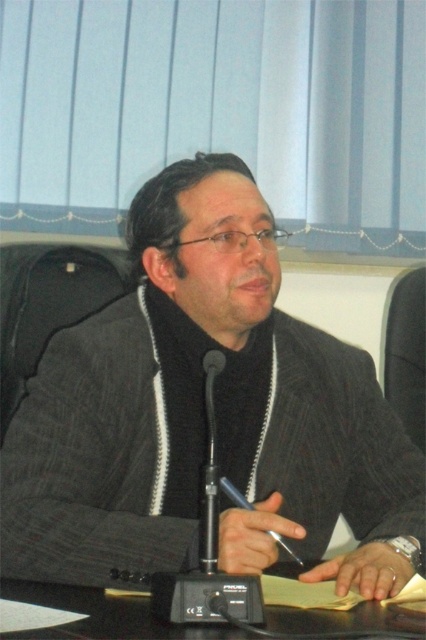
Question: Can you confirm if dark gray textured blazer at center is smaller than black glossy table at center?

Choices:
 (A) yes
 (B) no

Answer: (B)

Question: Which point appears closest to the camera in this image?

Choices:
 (A) (100, 369)
 (B) (210, 449)

Answer: (B)

Question: From the image, what is the correct spatial relationship of dark gray textured blazer at center in relation to black metallic microphone at center?

Choices:
 (A) above
 (B) below

Answer: (A)

Question: Which of the following is the closest to the observer?

Choices:
 (A) (157, 531)
 (B) (212, 444)

Answer: (B)

Question: Can you confirm if black glossy table at center is smaller than black metallic microphone at center?

Choices:
 (A) yes
 (B) no

Answer: (B)

Question: Which object is positioned farthest from the black metallic microphone at center?

Choices:
 (A) black glossy table at center
 (B) dark gray textured blazer at center

Answer: (B)